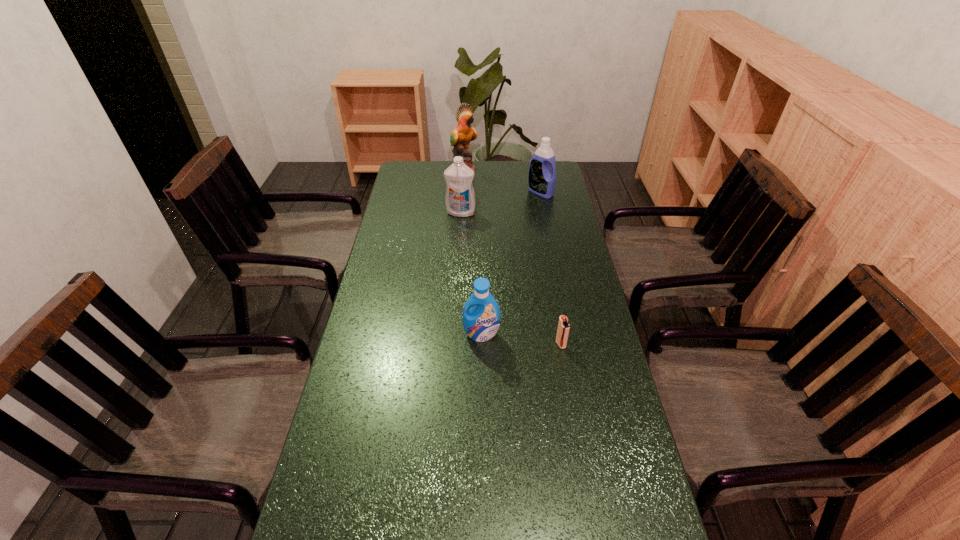
Where is `the tallest object`? This screenshot has width=960, height=540. the tallest object is located at coordinates (463, 133).

At what (x,y) coordinates should I click in order to perform the action: click on the farthest object. Please return your answer as a coordinate pair (x, y). The image size is (960, 540). Looking at the image, I should click on (463, 133).

Where is `the rightmost detergent`? the rightmost detergent is located at coordinates (542, 179).

I want to click on the farthest detergent, so click(542, 179).

I want to click on the third farthest object, so click(x=460, y=200).

Find the location of a particular element. Image resolution: width=960 pixels, height=540 pixels. the second shortest object is located at coordinates (481, 323).

Find the location of `the shortest detergent`. the shortest detergent is located at coordinates (481, 323).

The width and height of the screenshot is (960, 540). Find the location of `the shortest object`. the shortest object is located at coordinates (563, 328).

Find the location of a particular element. vacant space located on the front-facing side of the parrot is located at coordinates (547, 170).

Where is `free space located on the front of the farthest detergent`? free space located on the front of the farthest detergent is located at coordinates (550, 241).